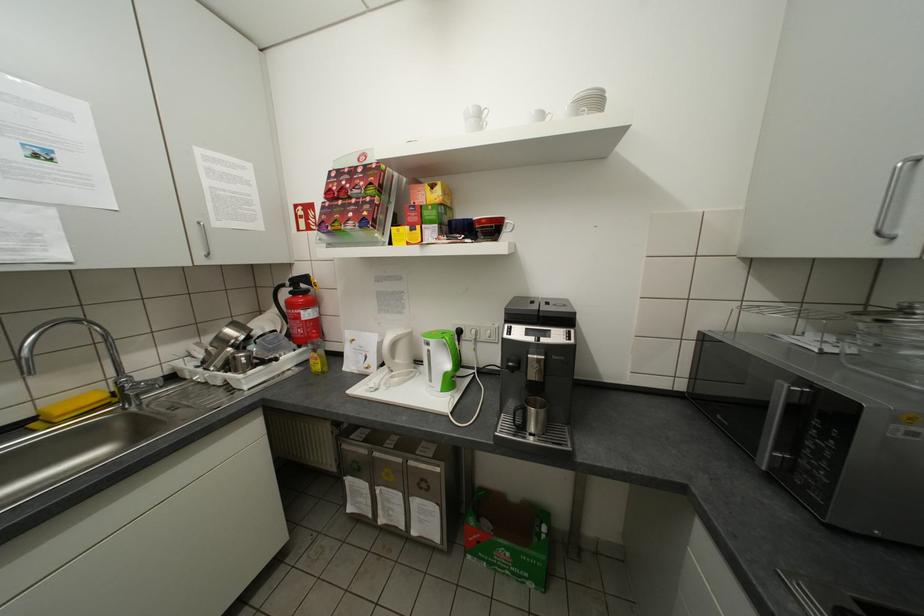
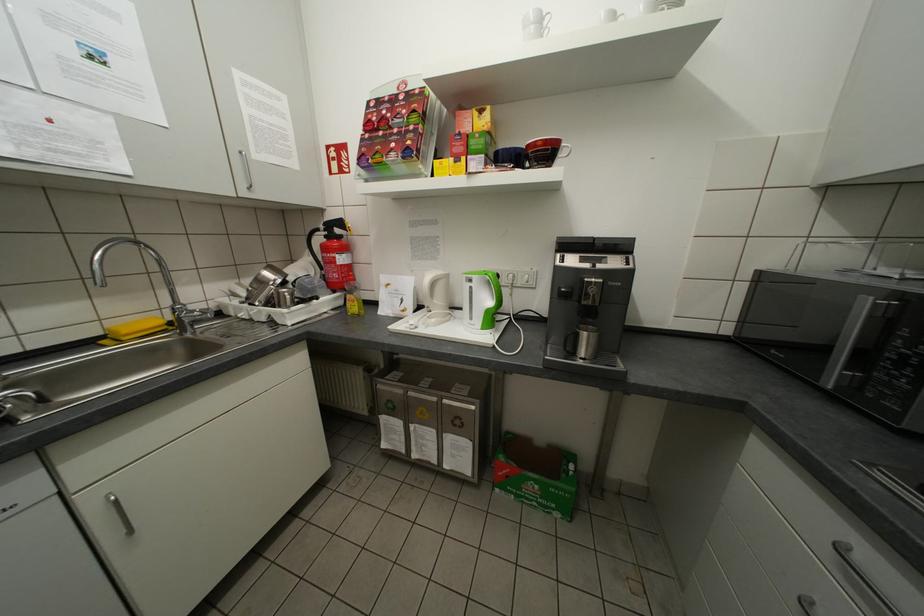
Locate, in the second image, the point that corresponds to pixel 492 222 in the first image.

(548, 144)